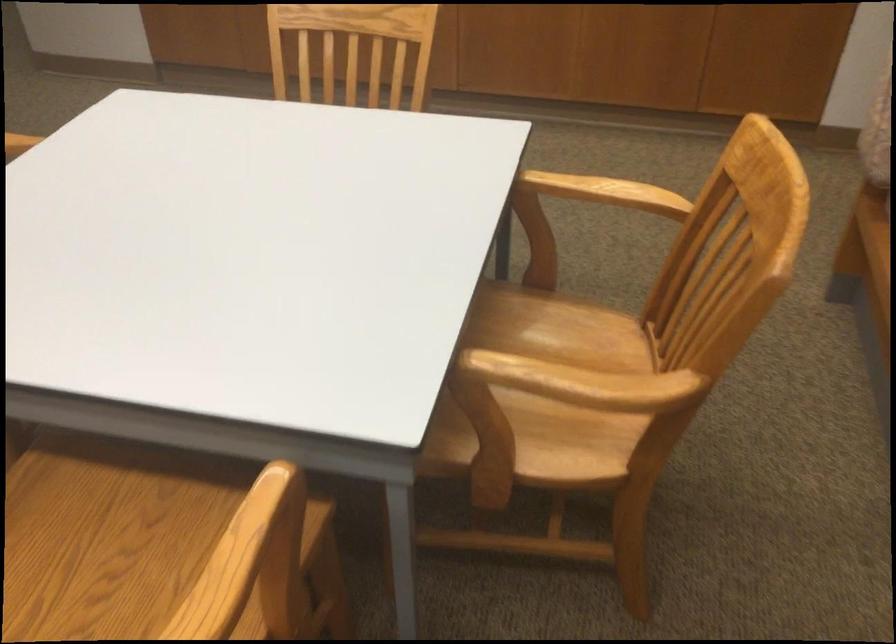
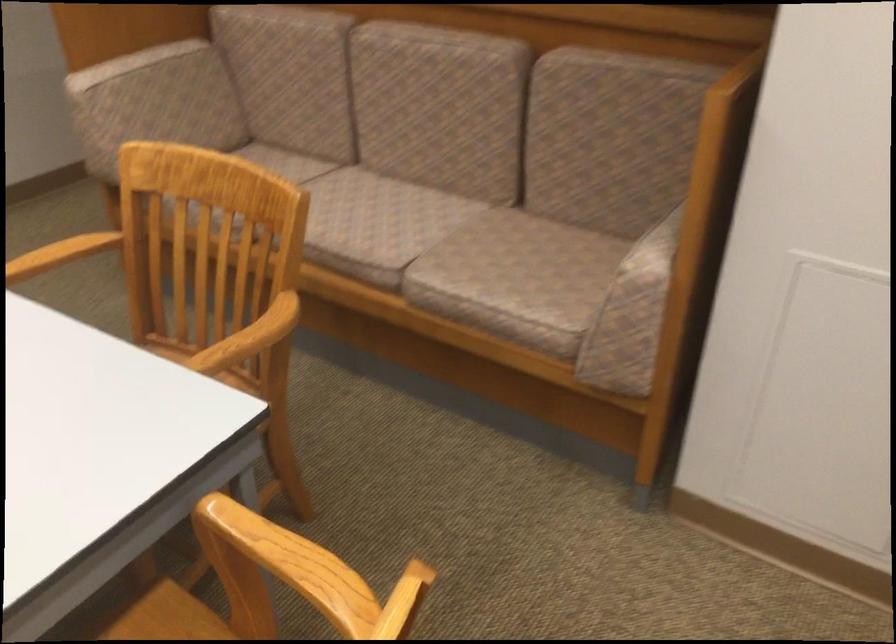
Find the pixel in the second image that matches pixel 631 192 in the first image.

(62, 252)